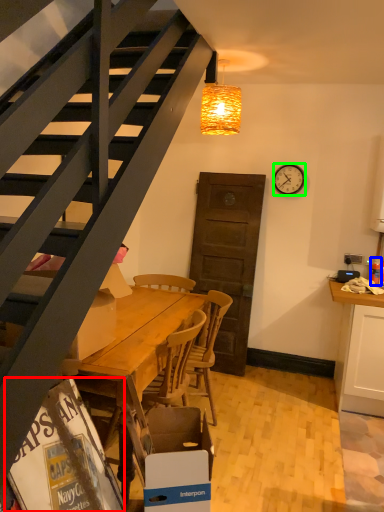
Question: Which object is positioned closest to magazine (highlighted by a red box)? Select from bottle (highlighted by a blue box) and clock (highlighted by a green box).

Choices:
 (A) bottle
 (B) clock

Answer: (A)